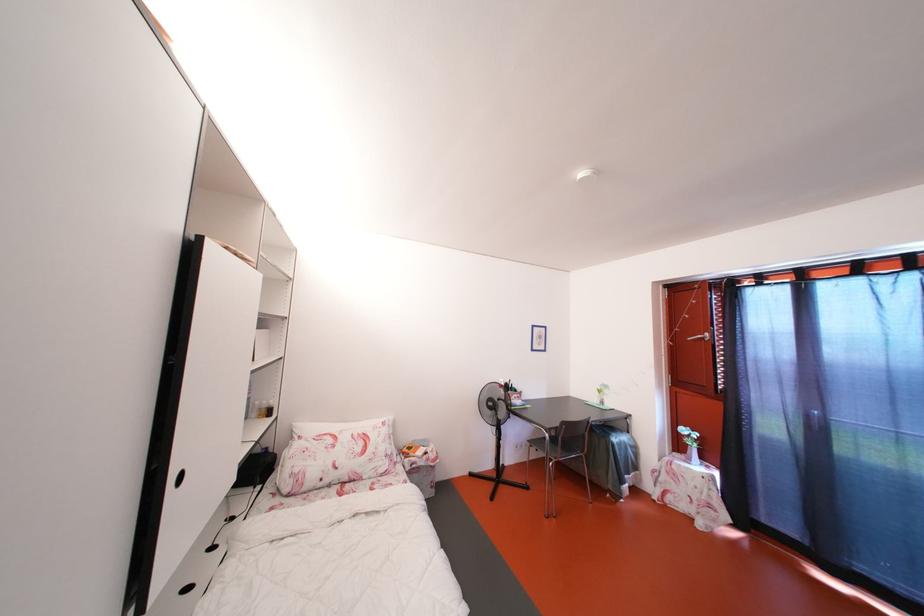
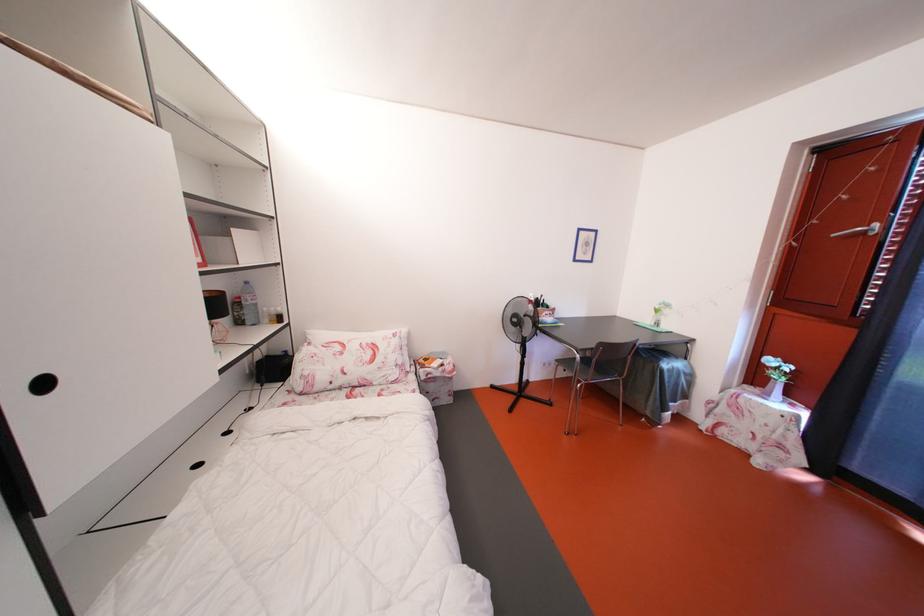
Locate, in the second image, the point that corresponds to (x=690, y=436) in the first image.

(779, 367)